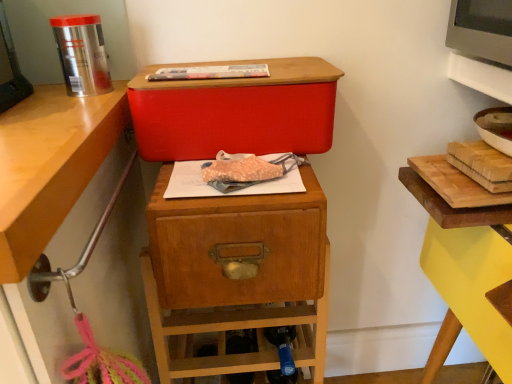
Question: In terms of width, does wooden drawer at center look wider or thinner when compared to matte plastic baguette at center?

Choices:
 (A) thin
 (B) wide

Answer: (B)

Question: From a real-world perspective, is wooden drawer at center above or below matte plastic baguette at center?

Choices:
 (A) above
 (B) below

Answer: (B)

Question: Based on their relative distances, which object is nearer to the matte plastic baguette at center?

Choices:
 (A) matte red storage box at center
 (B) wooden drawer at center

Answer: (A)

Question: Which of these objects is positioned closest to the matte red storage box at center?

Choices:
 (A) matte plastic baguette at center
 (B) wooden drawer at center

Answer: (A)